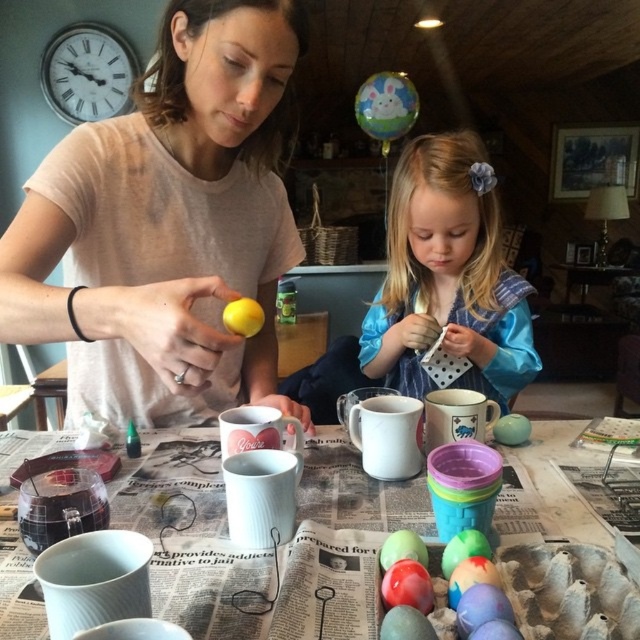
Question: Which point appears closest to the camera in this image?

Choices:
 (A) (419, 140)
 (B) (179, 554)
 (C) (401, 531)

Answer: (C)

Question: Is matte yellow egg at center closer to camera compared to yellow matte lemon at center?

Choices:
 (A) no
 (B) yes

Answer: (B)

Question: Is matte ceramic cups at center to the right of yellow matte lemon at center from the viewer's perspective?

Choices:
 (A) no
 (B) yes

Answer: (B)

Question: Which object is closer to the camera taking this photo?

Choices:
 (A) yellow matte lemon at center
 (B) blue satin dress at center
 (C) matte pastel egg at lower center

Answer: (C)

Question: Is blue satin dress at center above matte pastel egg at lower center?

Choices:
 (A) yes
 (B) no

Answer: (A)

Question: Which point is closer to the camera?

Choices:
 (A) smooth matte green egg at center
 (B) matte pastel egg at lower center
 (C) matte ceramic cups at center

Answer: (B)